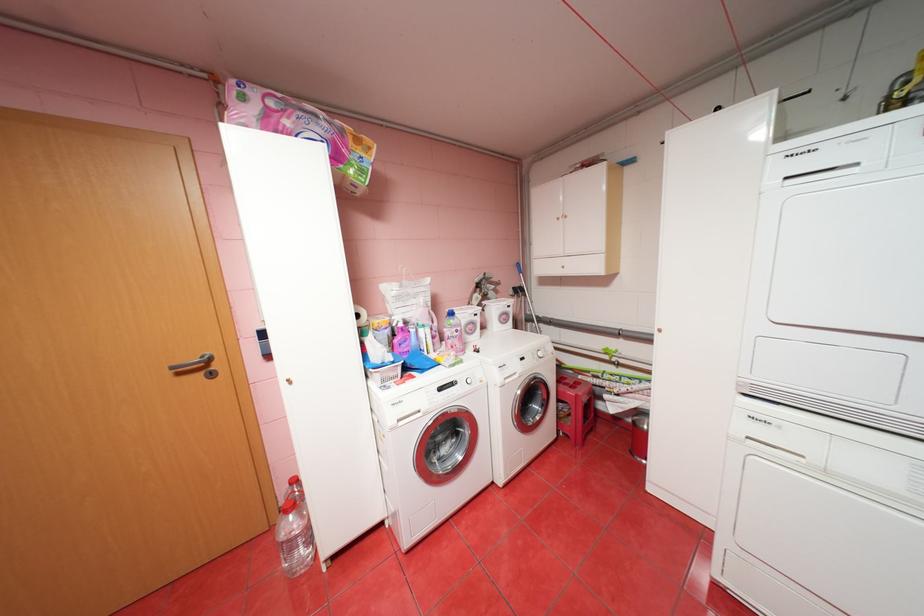
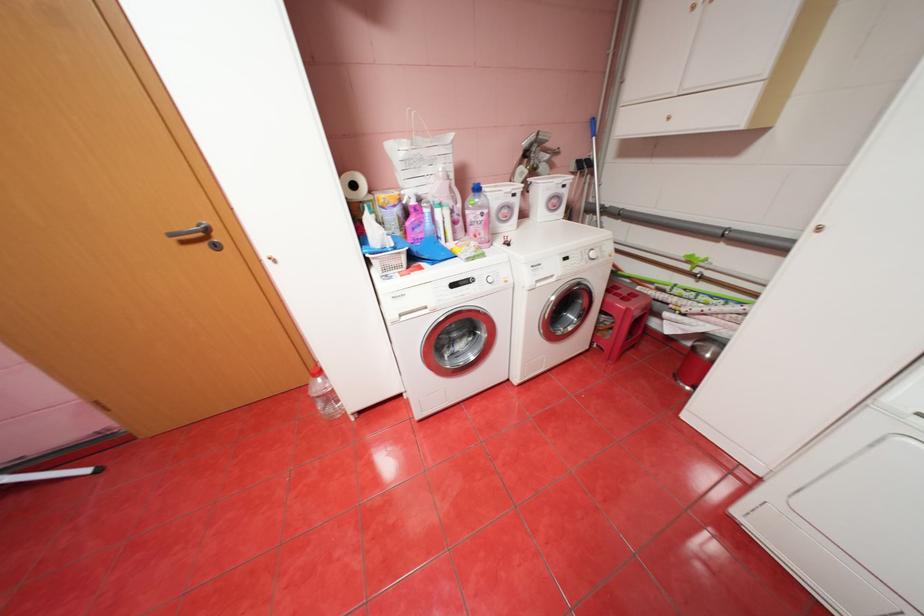
In the second image, find the point that corresponds to [580,383] in the first image.

(634, 294)